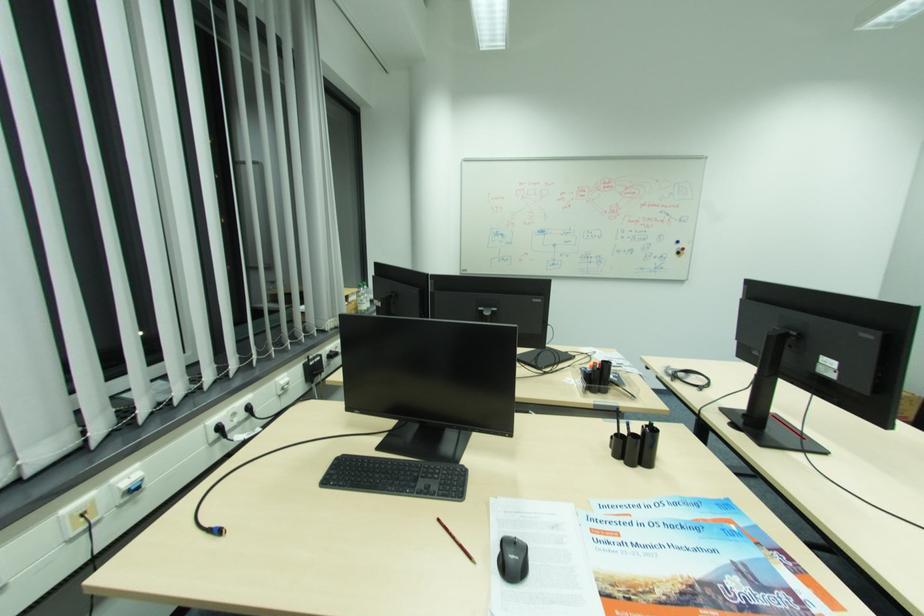
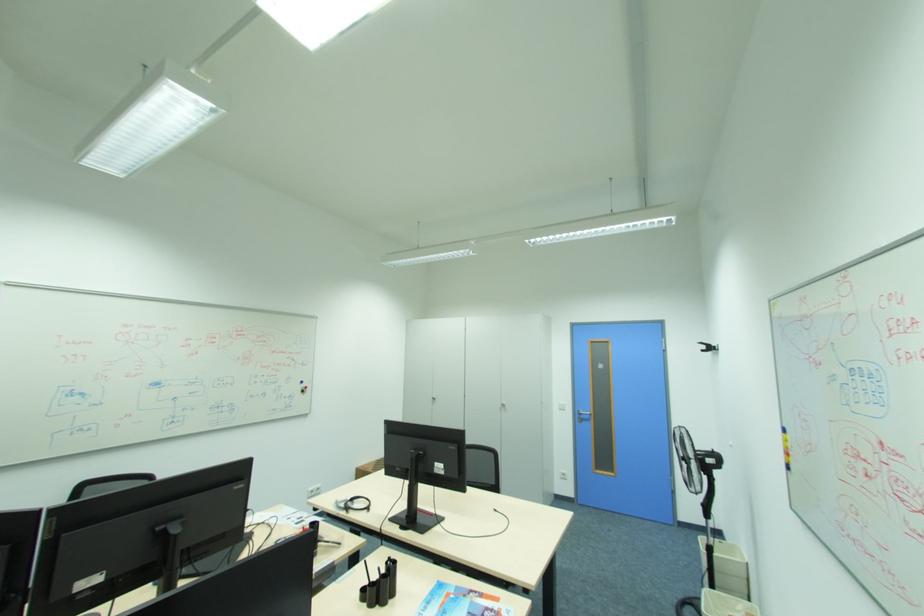
Question: Based on the continuous images, in which direction is the camera rotating? Reply with the corresponding letter.

Choices:
 (A) Left
 (B) Right
 (C) Up
 (D) Down

Answer: (B)